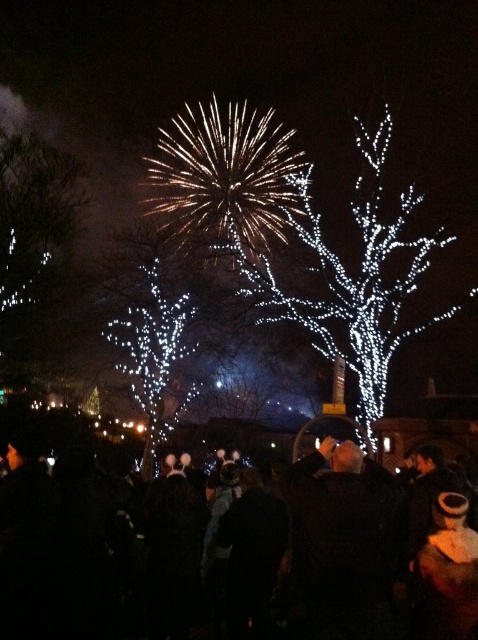
Between black fabric crowd at center and illuminated white tree at center, which one has more height?

Standing taller between the two is illuminated white tree at center.

Can you confirm if black fabric crowd at center is taller than illuminated white tree at center?

Incorrect, black fabric crowd at center's height is not larger of illuminated white tree at center's.

Is point (380, 524) positioned behind point (294, 221)?

No, (380, 524) is in front of (294, 221).

Where is `black fabric crowd at center`? The height and width of the screenshot is (640, 478). black fabric crowd at center is located at coordinates (44, 552).